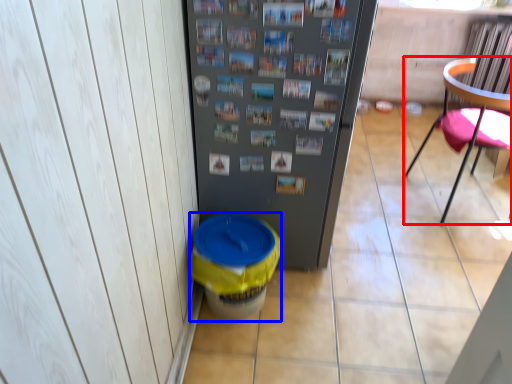
Question: Which object appears farthest to the camera in this image, chair (highlighted by a red box) or potty (highlighted by a blue box)?

Choices:
 (A) chair
 (B) potty

Answer: (A)